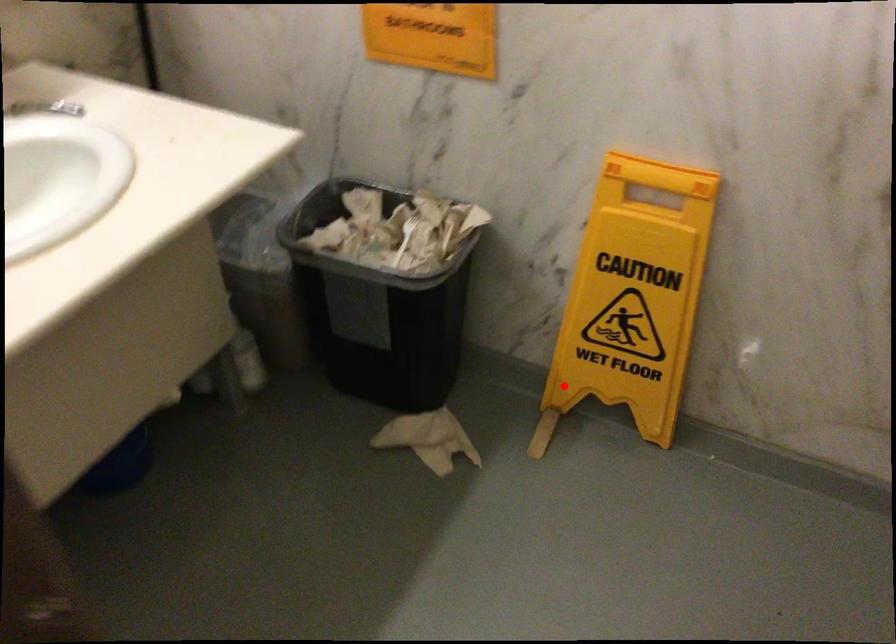
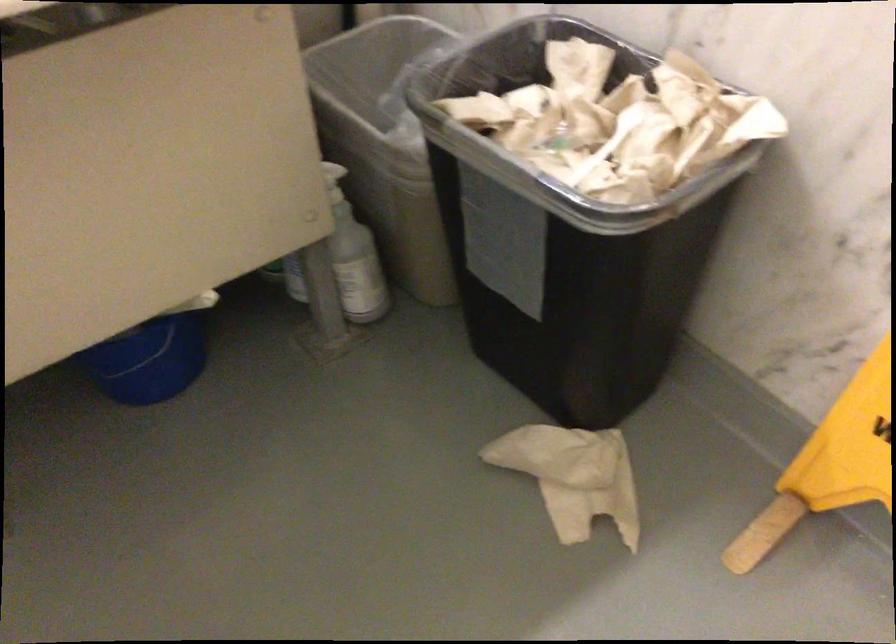
Locate, in the second image, the point that corresponds to the highlighted location in the first image.

(830, 464)